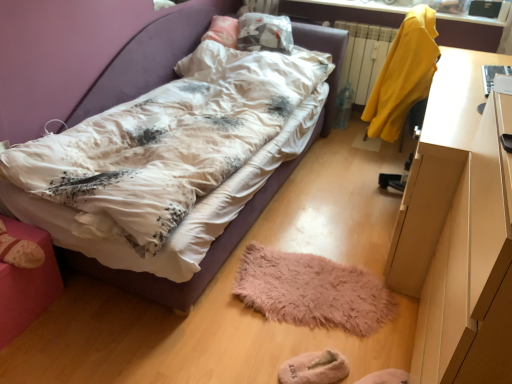
Question: Should I look upward or downward to see beige fuzzy slippers at lower center?

Choices:
 (A) up
 (B) down

Answer: (B)

Question: From a real-world perspective, is yellow fabric at upper right located higher than pink fabric ottoman at lower left?

Choices:
 (A) no
 (B) yes

Answer: (B)

Question: Is yellow fabric at upper right thinner than pink fabric ottoman at lower left?

Choices:
 (A) yes
 (B) no

Answer: (A)

Question: Considering the relative positions of yellow fabric at upper right and pink fabric ottoman at lower left in the image provided, is yellow fabric at upper right behind pink fabric ottoman at lower left?

Choices:
 (A) no
 (B) yes

Answer: (B)

Question: Considering the relative sizes of yellow fabric at upper right and pink fabric ottoman at lower left in the image provided, is yellow fabric at upper right wider than pink fabric ottoman at lower left?

Choices:
 (A) yes
 (B) no

Answer: (B)

Question: Can you confirm if yellow fabric at upper right is smaller than pink fabric ottoman at lower left?

Choices:
 (A) no
 (B) yes

Answer: (A)

Question: Can you confirm if yellow fabric at upper right is shorter than pink fabric ottoman at lower left?

Choices:
 (A) no
 (B) yes

Answer: (A)

Question: Would you say yellow fabric at upper right is outside white glossy desk at right?

Choices:
 (A) no
 (B) yes

Answer: (B)

Question: Is yellow fabric at upper right positioned in front of white glossy desk at right?

Choices:
 (A) yes
 (B) no

Answer: (B)

Question: Is yellow fabric at upper right touching white glossy desk at right?

Choices:
 (A) no
 (B) yes

Answer: (A)

Question: Does yellow fabric at upper right have a lesser height compared to white glossy desk at right?

Choices:
 (A) yes
 (B) no

Answer: (A)

Question: Does yellow fabric at upper right have a smaller size compared to white glossy desk at right?

Choices:
 (A) no
 (B) yes

Answer: (B)

Question: From a real-world perspective, is yellow fabric at upper right physically below white glossy desk at right?

Choices:
 (A) yes
 (B) no

Answer: (A)

Question: From the image's perspective, is white glossy desk at right beneath yellow fabric coat at upper right?

Choices:
 (A) no
 (B) yes

Answer: (B)